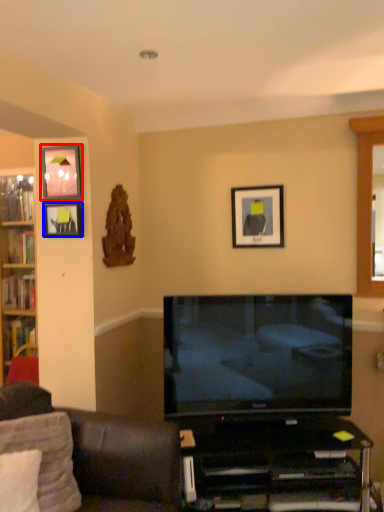
Question: Which object is further to the camera taking this photo, picture frame (highlighted by a red box) or picture frame (highlighted by a blue box)?

Choices:
 (A) picture frame
 (B) picture frame

Answer: (B)